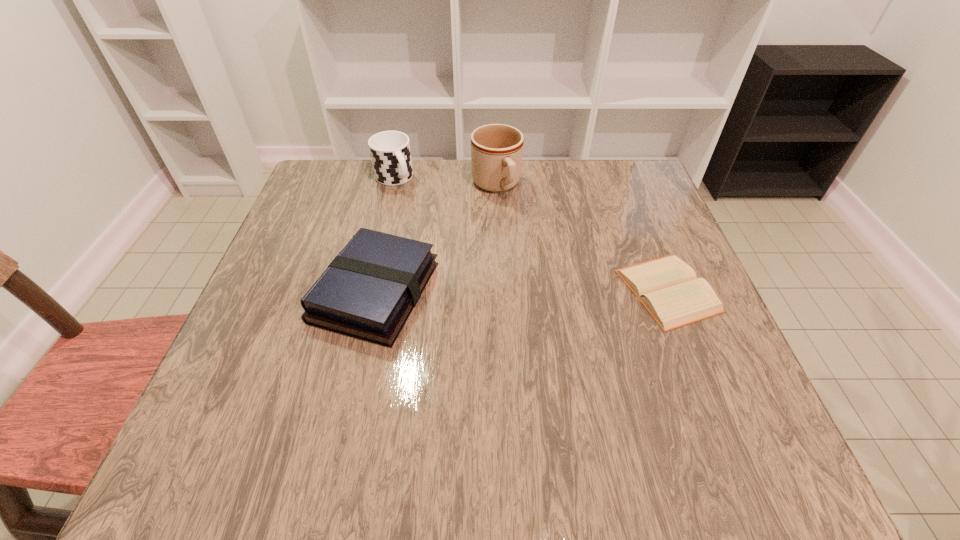
At what (x,y) coordinates should I click in order to perform the action: click on vacant space positioned 0.210m on the side of the tallest object with the handle. Please return your answer as a coordinate pair (x, y). Looking at the image, I should click on (537, 258).

At what (x,y) coordinates should I click in order to perform the action: click on vacant area situated on the side of the cup with the handle. Please return your answer as a coordinate pair (x, y). The height and width of the screenshot is (540, 960). Looking at the image, I should click on (451, 252).

Identify the location of free spot located on the side of the cup with the handle. This screenshot has width=960, height=540. (469, 274).

This screenshot has width=960, height=540. Identify the location of vacant space located 0.300m on the side of the cup with the handle. (456, 257).

At what (x,y) coordinates should I click in order to perform the action: click on mug at the far edge. Please return your answer as a coordinate pair (x, y). Looking at the image, I should click on (496, 149).

Find the location of `cup located in the far edge section of the desktop`. cup located in the far edge section of the desktop is located at coordinates (390, 152).

This screenshot has height=540, width=960. In order to click on object at the left edge in this screenshot , I will do `click(368, 291)`.

Identify the location of object located in the right edge section of the desktop. This screenshot has width=960, height=540. (667, 287).

What are the coordinates of `vacant space at the far edge of the desktop` in the screenshot? It's located at (417, 203).

Locate an element on the screen. blank space at the near edge is located at coordinates (448, 396).